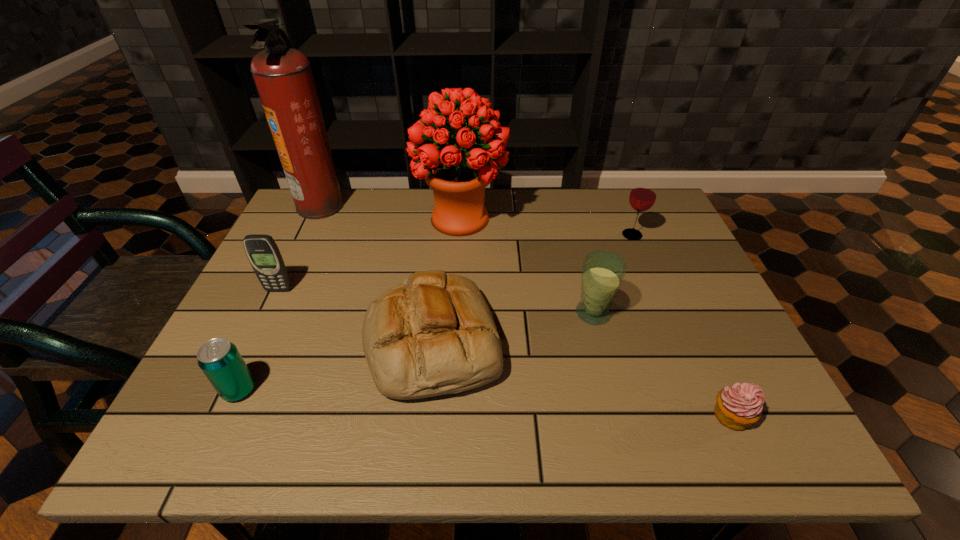
I want to click on object located at the near edge, so click(x=739, y=406).

This screenshot has height=540, width=960. I want to click on fire extinguisher that is at the left edge, so click(283, 77).

Where is `cellular telephone at the left edge`? This screenshot has height=540, width=960. cellular telephone at the left edge is located at coordinates (263, 253).

Where is `beer can positioned at the left edge`? This screenshot has height=540, width=960. beer can positioned at the left edge is located at coordinates (219, 359).

Locate an element on the screen. Image resolution: width=960 pixels, height=540 pixels. glass located at the right edge is located at coordinates (642, 197).

Where is `cupcake at the right edge`? cupcake at the right edge is located at coordinates (739, 406).

The height and width of the screenshot is (540, 960). I want to click on object that is at the far left corner, so click(x=283, y=77).

Where is `object that is at the far right corner`? This screenshot has height=540, width=960. object that is at the far right corner is located at coordinates (642, 197).

Find the location of a particular element. The width and height of the screenshot is (960, 540). object at the near right corner is located at coordinates (739, 406).

Identify the location of vacant area at the far edge of the desktop. (393, 199).